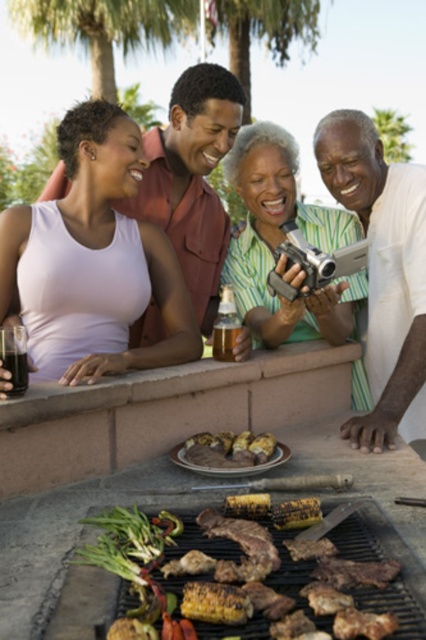
Is white cotton shirt at upper right to the left of translucent glass beverage at grill from the viewer's perspective?

Incorrect, white cotton shirt at upper right is not on the left side of translucent glass beverage at grill.

Looking at this image, is the position of white cotton shirt at upper right less distant than that of translucent glass beverage at grill?

That is True.

Find the location of a particular element. white cotton shirt at upper right is located at coordinates (383, 275).

Is point (218, 568) positioned after point (233, 284)?

No, (218, 568) is in front of (233, 284).

What do you see at coordinates (276, 582) in the screenshot? The image size is (426, 640). I see `charred yellow corn at center` at bounding box center [276, 582].

Which is behind, point (388, 630) or point (290, 321)?

Point (290, 321)

I want to click on charred yellow corn at center, so click(x=276, y=582).

Who is lower down, white cotton shirt at upper right or green matte camera at center?

white cotton shirt at upper right is below.

This screenshot has height=640, width=426. What do you see at coordinates (383, 275) in the screenshot?
I see `white cotton shirt at upper right` at bounding box center [383, 275].

Which is in front, point (380, 376) or point (356, 380)?

Point (380, 376) is more forward.

Find the location of a particular element. The height and width of the screenshot is (640, 426). white cotton shirt at upper right is located at coordinates (383, 275).